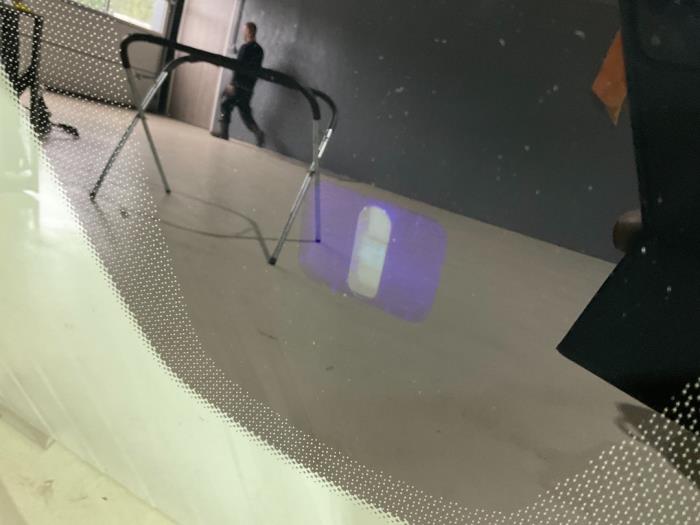
Image resolution: width=700 pixels, height=525 pixels. Find the location of `floor`. floor is located at coordinates (522, 291).